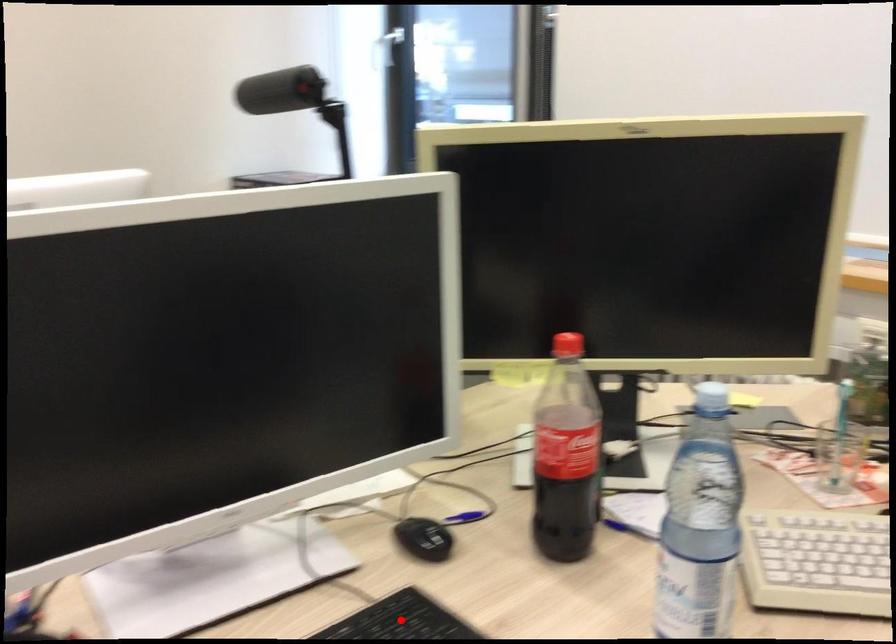
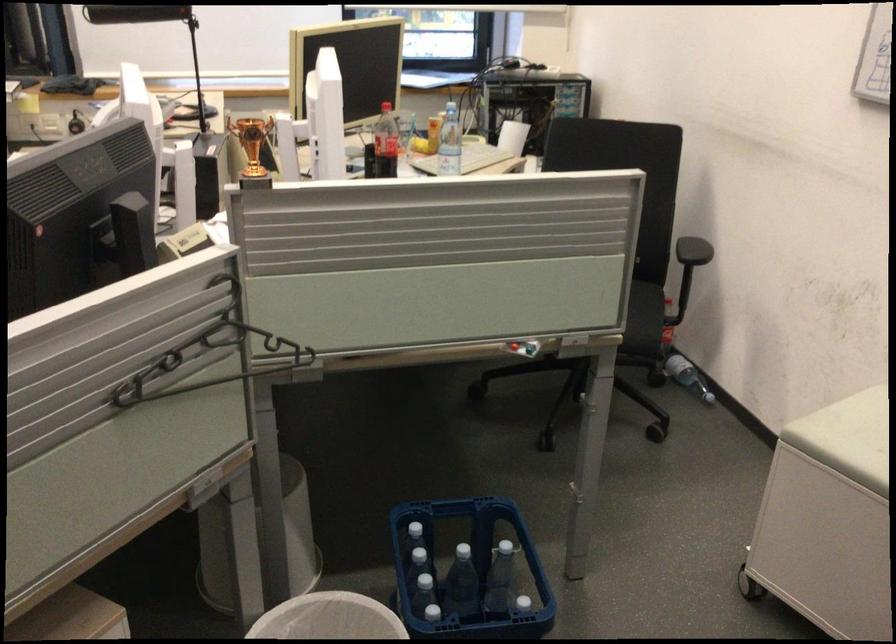
Question: I am providing you with two images of the same scene from different viewpoints. A red point is marked on the first image. At the location where the point appears in image 1, is it still visible in image 2?

Choices:
 (A) Yes
 (B) No

Answer: (B)